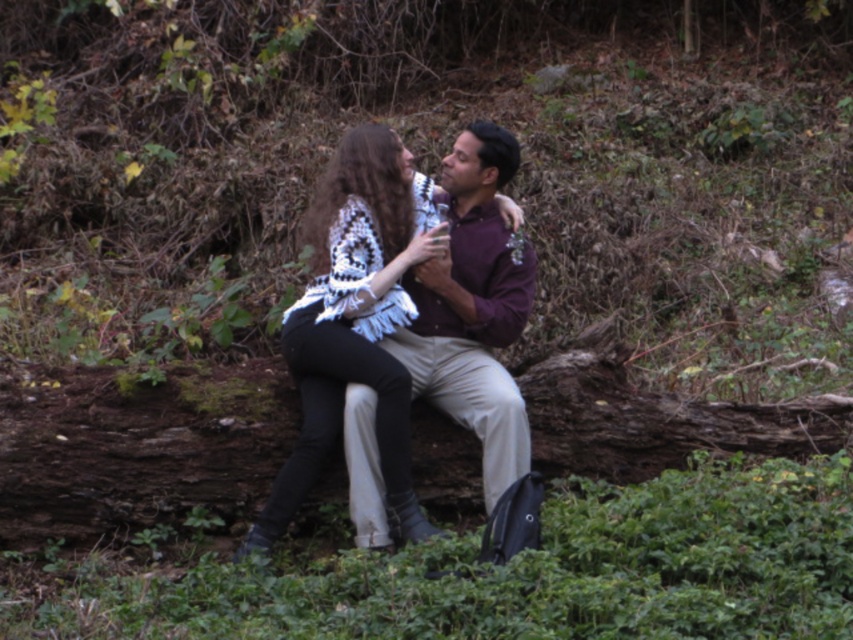
Does white crochet sweater at center appear over purple matte shirt at center?

Yes, white crochet sweater at center is above purple matte shirt at center.

Between point (343, 282) and point (494, 378), which one is positioned behind?

Point (494, 378)

Who is more forward, (402, 465) or (444, 412)?

Positioned in front is point (402, 465).

The image size is (853, 640). In order to click on white crochet sweater at center in this screenshot , I will do `click(354, 323)`.